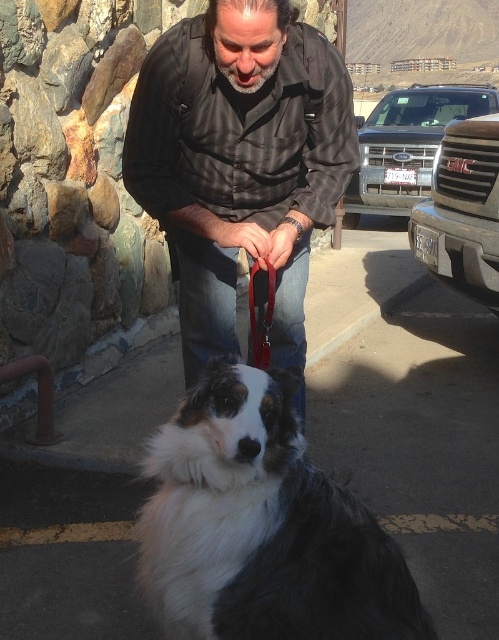
You are a photographer trying to capture a photo of the metallic silver grille at right and the red leather leash at center. Which object should you focus on first if you want to ensure both are in focus without adjusting your camera settings?

The metallic silver grille at right is taller than the red leather leash at center, so focusing on the metallic silver grille at right first would help ensure both are in focus since it is larger and occupies more space in the frame.